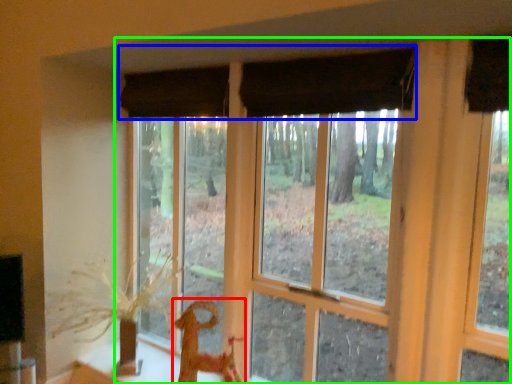
Question: Which is farther away from animal (highlighted by a red box)? curtain (highlighted by a blue box) or window (highlighted by a green box)?

Choices:
 (A) curtain
 (B) window

Answer: (A)